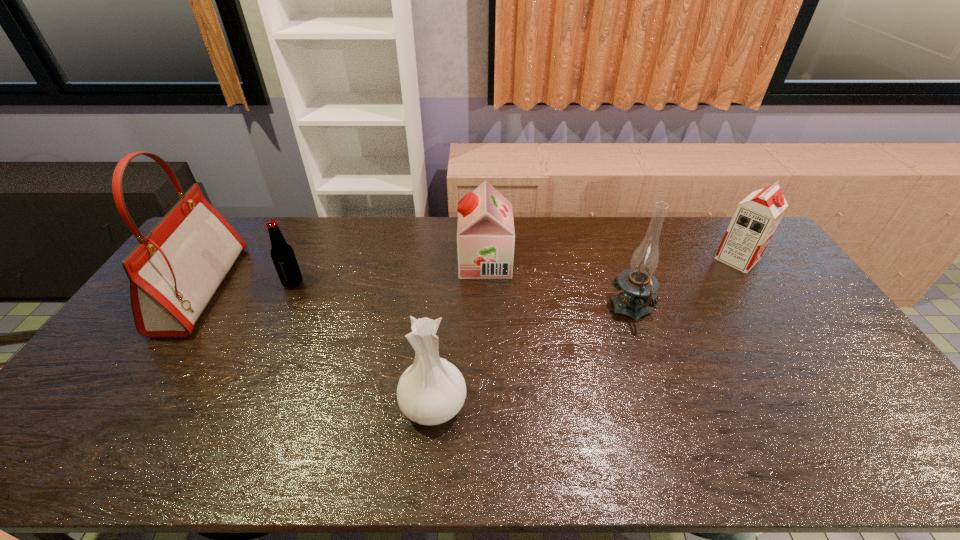
Where is `object located at the right edge`? The width and height of the screenshot is (960, 540). object located at the right edge is located at coordinates (756, 218).

At what (x,y) coordinates should I click in order to perform the action: click on object that is at the far left corner. Please return your answer as a coordinate pair (x, y). Image resolution: width=960 pixels, height=540 pixels. Looking at the image, I should click on (174, 272).

At what (x,y) coordinates should I click in order to perform the action: click on object that is at the far right corner. Please return your answer as a coordinate pair (x, y). Image resolution: width=960 pixels, height=540 pixels. Looking at the image, I should click on (756, 218).

Image resolution: width=960 pixels, height=540 pixels. I want to click on blank space at the far edge of the desktop, so click(x=457, y=256).

Find the location of a particular element. Image resolution: width=960 pixels, height=540 pixels. blank space at the near edge of the desktop is located at coordinates (298, 444).

Where is `vacant space at the left edge of the desktop`? Image resolution: width=960 pixels, height=540 pixels. vacant space at the left edge of the desktop is located at coordinates (118, 402).

Where is `free space at the right edge`? free space at the right edge is located at coordinates (799, 353).

Find the location of `vacant space at the near left corner of the desktop`. vacant space at the near left corner of the desktop is located at coordinates (96, 445).

Identify the location of free space between the left soya milk and the handbag. This screenshot has height=540, width=960. (344, 275).

Find the location of a particular element. empty space that is in between the nearest object and the rightmost object is located at coordinates (586, 331).